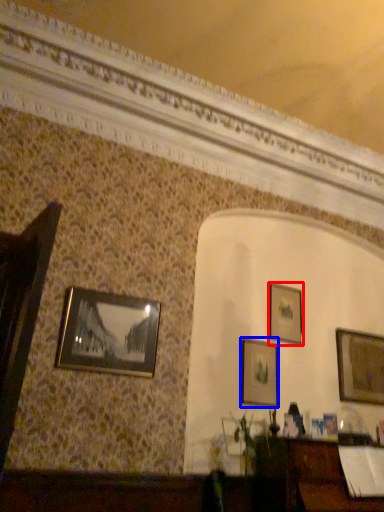
Question: Among these objects, which one is farthest to the camera, picture frame (highlighted by a red box) or picture frame (highlighted by a blue box)?

Choices:
 (A) picture frame
 (B) picture frame

Answer: (A)